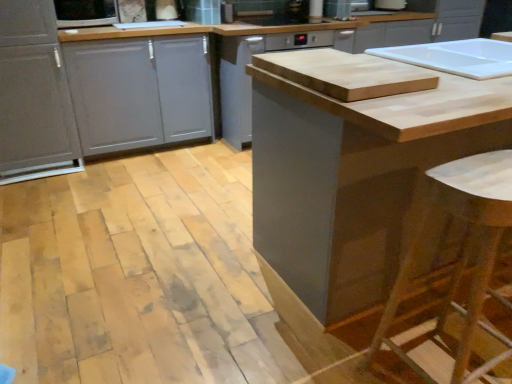
Question: Does natural wood cutting board at center contain metallic silver dishwasher at upper center?

Choices:
 (A) no
 (B) yes

Answer: (A)

Question: From the image's perspective, does natural wood cutting board at center appear lower than metallic silver dishwasher at upper center?

Choices:
 (A) yes
 (B) no

Answer: (A)

Question: Are natural wood cutting board at center and metallic silver dishwasher at upper center far apart?

Choices:
 (A) yes
 (B) no

Answer: (A)

Question: Does natural wood cutting board at center have a larger size compared to metallic silver dishwasher at upper center?

Choices:
 (A) no
 (B) yes

Answer: (B)

Question: Considering the relative positions of natural wood cutting board at center and metallic silver dishwasher at upper center in the image provided, is natural wood cutting board at center behind metallic silver dishwasher at upper center?

Choices:
 (A) no
 (B) yes

Answer: (A)

Question: Is point (108, 52) positioned closer to the camera than point (390, 3)?

Choices:
 (A) farther
 (B) closer

Answer: (B)

Question: In terms of height, does matte gray drawer at left look taller or shorter compared to metallic silver dishwasher at upper center?

Choices:
 (A) short
 (B) tall

Answer: (B)

Question: In the image, is matte gray drawer at left on the left side or the right side of metallic silver dishwasher at upper center?

Choices:
 (A) left
 (B) right

Answer: (A)

Question: From the image's perspective, is matte gray drawer at left positioned above or below metallic silver dishwasher at upper center?

Choices:
 (A) below
 (B) above

Answer: (A)

Question: From their relative heights in the image, would you say matte gray dishwasher at center, the 2th cabinetry when ordered from left to right, is taller or shorter than matte gray cabinet at left, arranged as the third cabinetry when viewed from the right?

Choices:
 (A) short
 (B) tall

Answer: (A)

Question: Considering their positions, is matte gray dishwasher at center, the 2th cabinetry when ordered from right to left, located in front of or behind matte gray cabinet at left, the 1th cabinetry when ordered from left to right?

Choices:
 (A) front
 (B) behind

Answer: (B)

Question: From a real-world perspective, is matte gray dishwasher at center, the 2th cabinetry when ordered from left to right, physically located above or below matte gray cabinet at left, the 1th cabinetry when ordered from left to right?

Choices:
 (A) above
 (B) below

Answer: (B)

Question: In terms of width, does matte gray dishwasher at center, the 2th cabinetry when ordered from left to right, look wider or thinner when compared to matte gray cabinet at left, arranged as the third cabinetry when viewed from the right?

Choices:
 (A) wide
 (B) thin

Answer: (A)

Question: Considering their positions, is wooden bar stool at lower right located in front of or behind matte white microwave at upper left?

Choices:
 (A) front
 (B) behind

Answer: (A)

Question: Is wooden bar stool at lower right taller or shorter than matte white microwave at upper left?

Choices:
 (A) short
 (B) tall

Answer: (B)